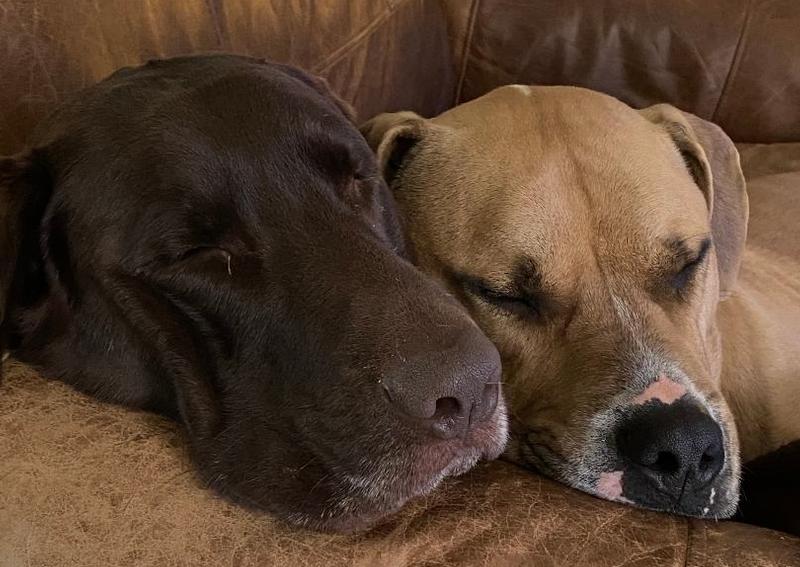
Find the location of a particular element. couch is located at coordinates (142, 502).